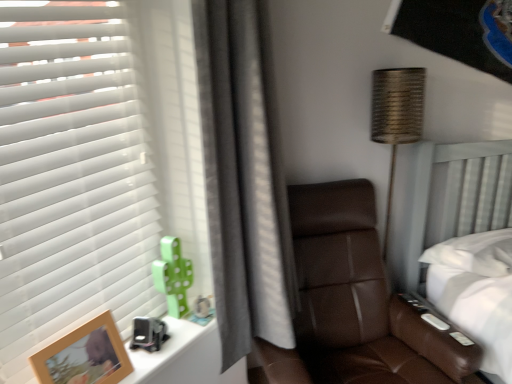
Question: Is wooden photo frame at lower left behind green matte cactus at left?

Choices:
 (A) no
 (B) yes

Answer: (A)

Question: Does wooden photo frame at lower left have a greater width compared to green matte cactus at left?

Choices:
 (A) no
 (B) yes

Answer: (B)

Question: Is green matte cactus at left surrounded by wooden photo frame at lower left?

Choices:
 (A) no
 (B) yes

Answer: (A)

Question: Could you tell me if wooden photo frame at lower left is facing green matte cactus at left?

Choices:
 (A) no
 (B) yes

Answer: (A)

Question: From the image's perspective, is wooden photo frame at lower left over green matte cactus at left?

Choices:
 (A) yes
 (B) no

Answer: (B)

Question: Can you confirm if wooden photo frame at lower left is smaller than green matte cactus at left?

Choices:
 (A) yes
 (B) no

Answer: (B)

Question: Is brown leather chair at center bigger than wooden photo frame at lower left?

Choices:
 (A) yes
 (B) no

Answer: (A)

Question: Is brown leather chair at center in contact with wooden photo frame at lower left?

Choices:
 (A) yes
 (B) no

Answer: (B)

Question: Could you tell me if brown leather chair at center is facing wooden photo frame at lower left?

Choices:
 (A) no
 (B) yes

Answer: (A)

Question: From the image's perspective, does brown leather chair at center appear lower than wooden photo frame at lower left?

Choices:
 (A) yes
 (B) no

Answer: (A)

Question: From the image's perspective, is brown leather chair at center on top of wooden photo frame at lower left?

Choices:
 (A) yes
 (B) no

Answer: (B)

Question: Is wooden photo frame at lower left surrounded by brown leather chair at center?

Choices:
 (A) no
 (B) yes

Answer: (A)

Question: Can you confirm if wooden photo frame at lower left is thinner than brown leather chair at center?

Choices:
 (A) yes
 (B) no

Answer: (A)